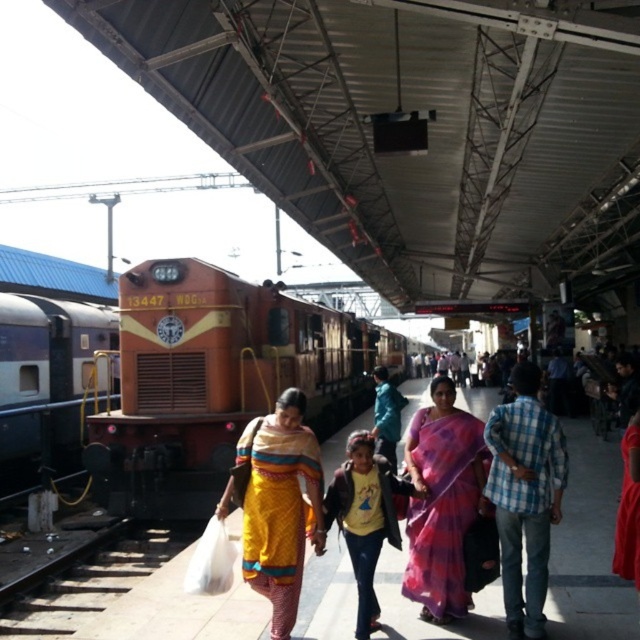
You are standing at point A on the train station platform. You see two points marked as point A at position [102,337] and point B at position [305,536]. If you want to walk towards point B, will you pass through point A first?

Point A at position [102,337] is behind point B at position [305,536], so you will not pass through point A first when walking towards point B.

You are standing on the platform at the train station. You see the matte orange train at left. If the platform is 30 feet long, can you safely walk to the end of the platform without getting too close to the train?

The matte orange train at left is 33.56 feet away from the viewer. Since the platform is only 30 feet long, the train is actually beyond the platform end, so walking to the end of the platform is safe as the train is not within the platform area.